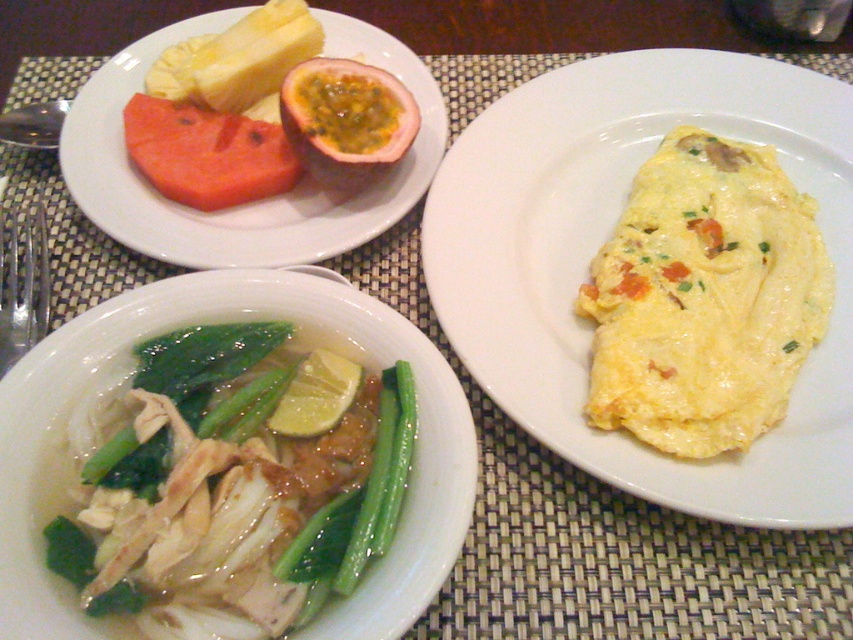
Question: Based on their relative distances, which object is nearer to the green smooth/leathery vegetable at lower center?

Choices:
 (A) passionfruitseedy fleshfruit at upper center
 (B) yellow butter at upper left
 (C) green leafy vegetables at lower left

Answer: (C)

Question: Which point appears closest to the camera in this image?

Choices:
 (A) tap(247, 56)
 (B) tap(312, 124)

Answer: (B)

Question: Can you confirm if yellow creamy omelette at center right is positioned to the right of silver metallic fork at left?

Choices:
 (A) yes
 (B) no

Answer: (A)

Question: Can you confirm if yellow/yellowish smooth omelette at center is bigger than matte red watermelon at upper left?

Choices:
 (A) yes
 (B) no

Answer: (A)

Question: Among these objects, which one is nearest to the camera?

Choices:
 (A) silver metallic fork at left
 (B) green leafy vegetables at lower left
 (C) green smooth/leathery vegetable at lower center
 (D) passionfruitseedy fleshfruit at upper center

Answer: (B)

Question: Is yellow/yellowish smooth omelette at center below green leafy vegetables at lower left?

Choices:
 (A) yes
 (B) no

Answer: (B)